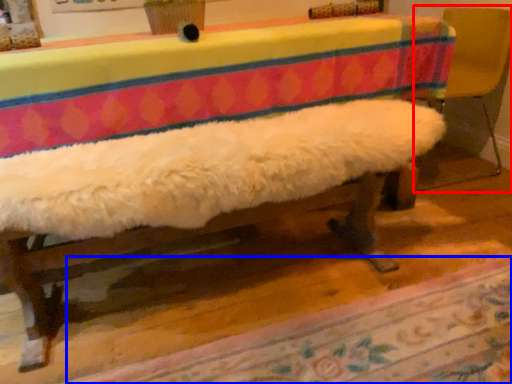
Question: Among these objects, which one is farthest to the camera, armchair (highlighted by a red box) or mat (highlighted by a blue box)?

Choices:
 (A) armchair
 (B) mat

Answer: (A)